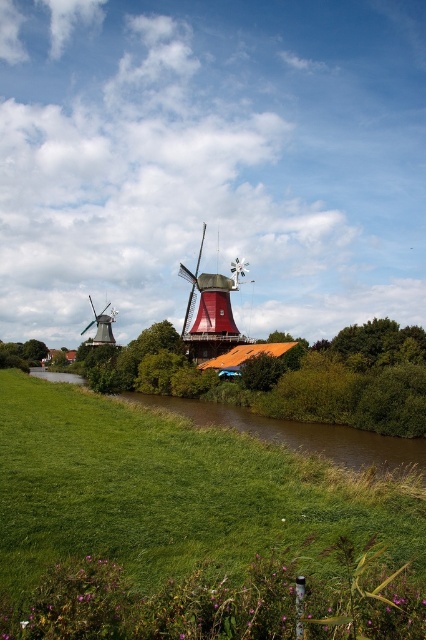
Who is taller, green grassy at center or matte red windmill at left?

matte red windmill at left

Is green grassy at center bigger than matte red windmill at left?

No.

The image size is (426, 640). I want to click on green grassy at center, so click(180, 528).

Who is lower down, red wood windmill at center or matte red windmill at left?

matte red windmill at left is below.

Who is higher up, red wood windmill at center or matte red windmill at left?

red wood windmill at center is above.

What do you see at coordinates (210, 310) in the screenshot?
I see `red wood windmill at center` at bounding box center [210, 310].

What are the coordinates of `red wood windmill at center` in the screenshot? It's located at (210, 310).

At what (x,y) coordinates should I click in order to perform the action: click on brown grassy river at center. Please return your answer as a coordinate pair (x, y). This screenshot has height=640, width=426. Looking at the image, I should click on (302, 435).